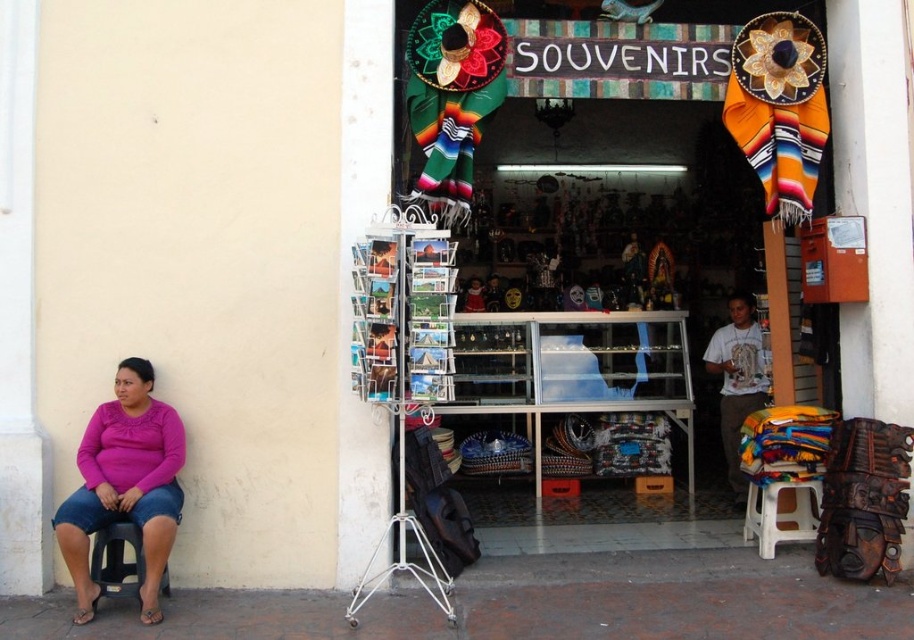
Question: Estimate the real-world distances between objects in this image. Which object is closer to the white plastic stool at lower right?

Choices:
 (A) black plastic stool at lower left
 (B) pink matte shirt at lower left

Answer: (B)

Question: Can you confirm if pink matte shirt at lower left is bigger than white plastic stool at lower right?

Choices:
 (A) no
 (B) yes

Answer: (B)

Question: Does pink matte shirt at lower left come in front of black plastic stool at lower left?

Choices:
 (A) no
 (B) yes

Answer: (B)

Question: Can you confirm if white plastic stool at lower right is positioned to the right of black plastic stool at lower left?

Choices:
 (A) yes
 (B) no

Answer: (A)

Question: Among these objects, which one is nearest to the camera?

Choices:
 (A) white plastic stool at lower right
 (B) pink matte shirt at lower left
 (C) black plastic stool at lower left

Answer: (B)

Question: Which point is closer to the camera taking this photo?

Choices:
 (A) (137, 436)
 (B) (97, 557)
 (C) (761, 536)

Answer: (B)